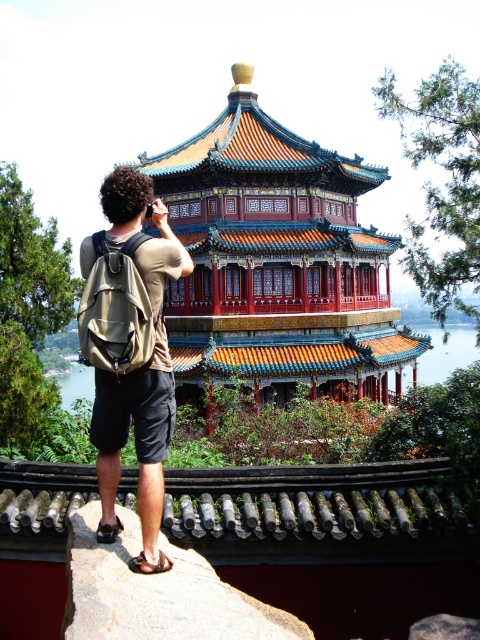
You are a photographer wanting to capture the shiny lacquered pavilion at center without any obstructions. You notice the khaki fabric backpack at center in the scene. Is the backpack blocking your view of the pavilion?

The khaki fabric backpack at center is behind the shiny lacquered pavilion at center, so it is not blocking your view of the pavilion. You can take the photo without any obstructions.

You are standing at point (276,262) in the scene. What object is located exactly at your current position?

The shiny lacquered pavilion at center is located exactly at point (276,262).

You are standing on a stone ledge with a camera, and you want to take a photo of the shiny lacquered pavilion at center. The camera can focus on objects up to 60 feet away. Will the pavilion be in focus?

The shiny lacquered pavilion at center is 58.18 feet away from the viewer, which is within the camera focus range of up to 60 feet. Therefore, the pavilion will be in focus.